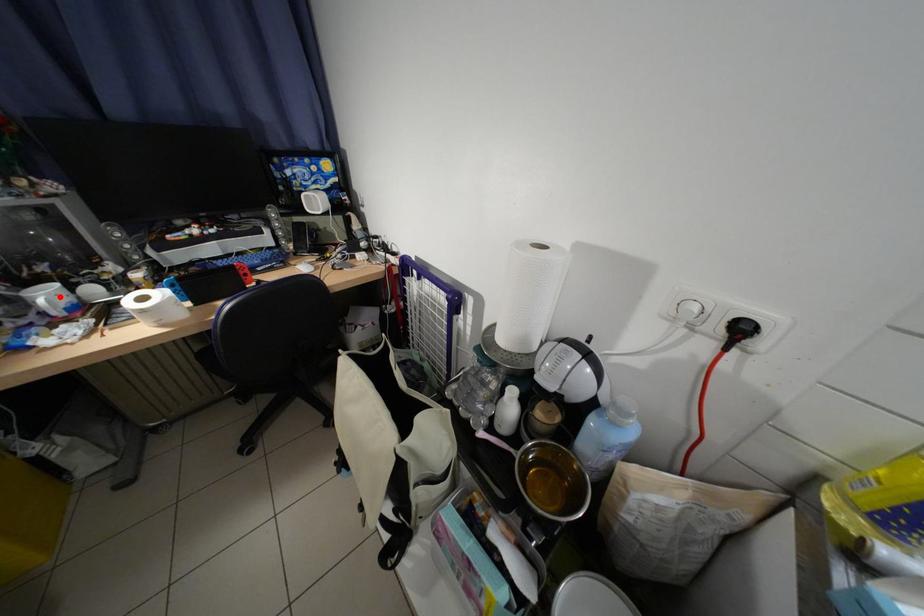
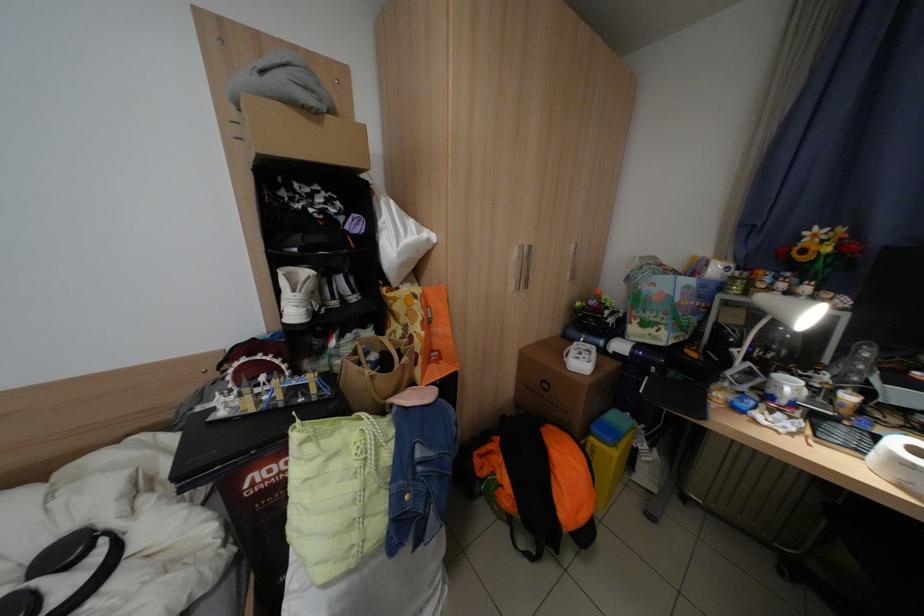
Locate, in the second image, the point that corresponds to the highlighted location in the first image.

(800, 387)